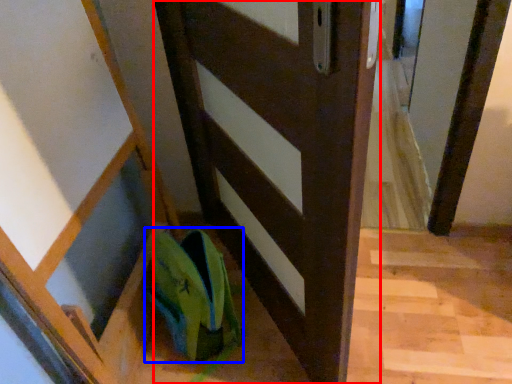
Question: Which object appears closest to the camera in this image, door (highlighted by a red box) or shoe (highlighted by a blue box)?

Choices:
 (A) door
 (B) shoe

Answer: (A)